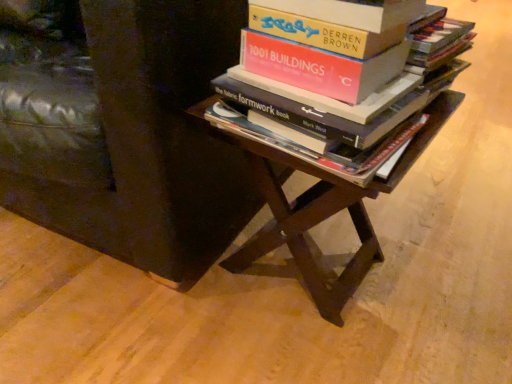
Question: In terms of size, does hardcover book at center appear bigger or smaller than brown wooden table at center?

Choices:
 (A) big
 (B) small

Answer: (B)

Question: From a real-world perspective, is hardcover book at center positioned above or below brown wooden table at center?

Choices:
 (A) above
 (B) below

Answer: (A)

Question: Based on their relative distances, which object is farther from the wooden side table at center?

Choices:
 (A) brown wooden table at center
 (B) hardcover book at center

Answer: (B)

Question: Estimate the real-world distances between objects in this image. Which object is farther from the wooden side table at center?

Choices:
 (A) brown wooden table at center
 (B) hardcover book at center

Answer: (B)